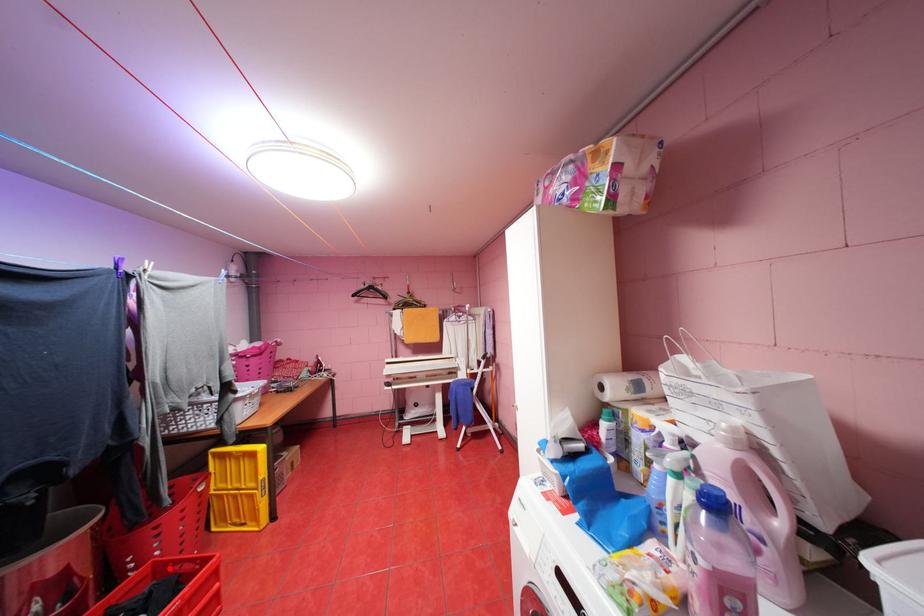
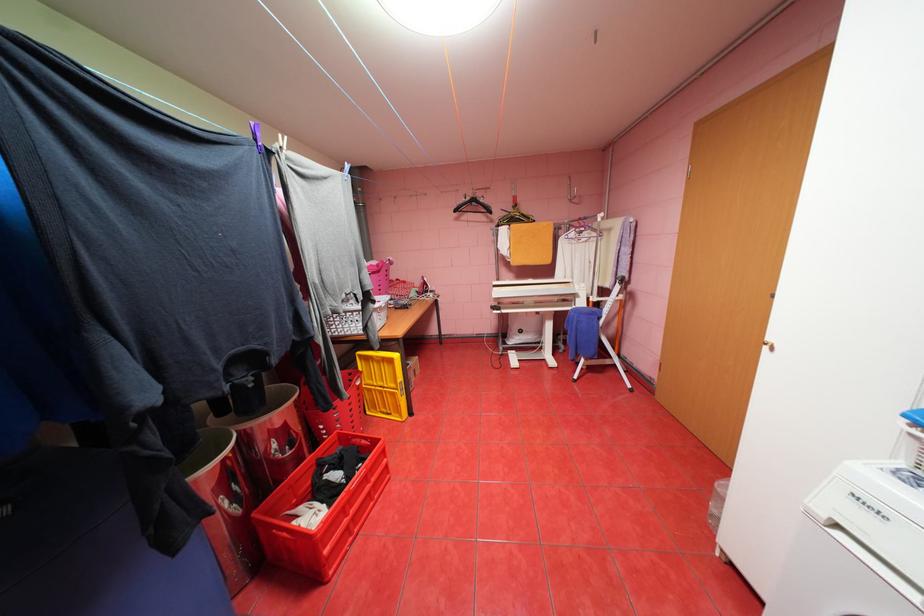
In the second image, find the point that corresponds to the highlighted location in the first image.

(351, 438)